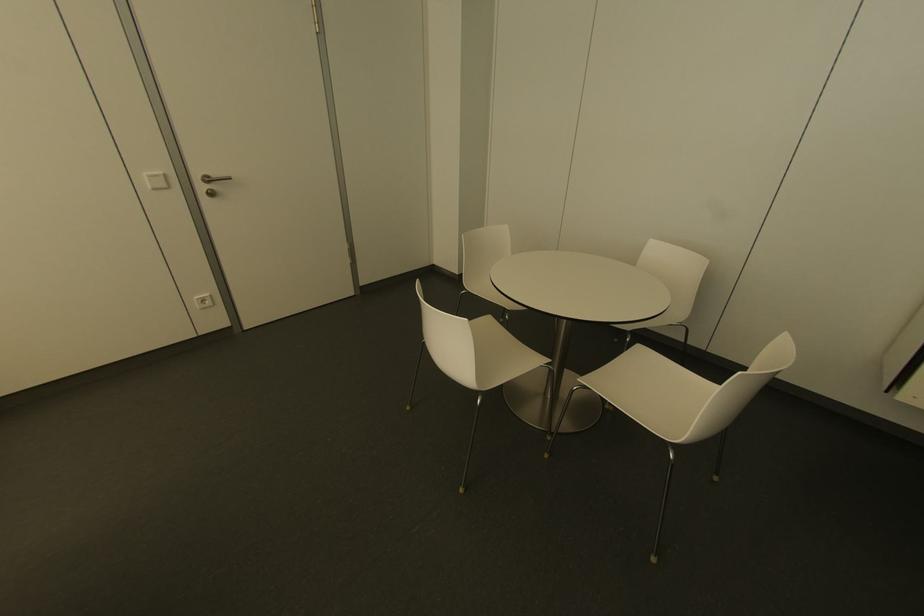
Where would you press the white light switch? Please return your answer as a coordinate pair (x, y).

(155, 180)